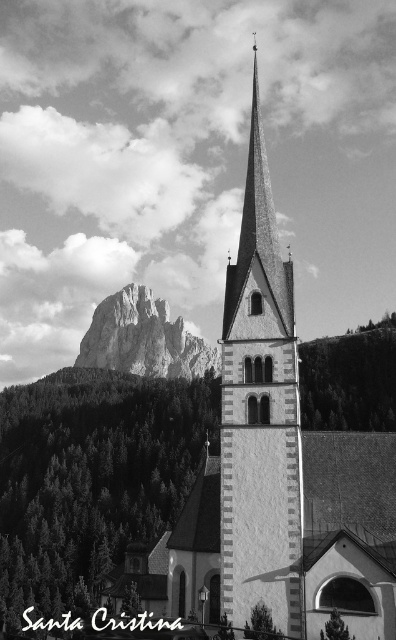
Who is taller, white stone tower at center or rugged stone mountain at center?

Standing taller between the two is white stone tower at center.

Is point (279, 440) closer to camera compared to point (121, 337)?

Yes, it is in front of point (121, 337).

Which is in front, point (253, 177) or point (203, 368)?

Point (253, 177)

Where is `white stone tower at center`? white stone tower at center is located at coordinates (260, 413).